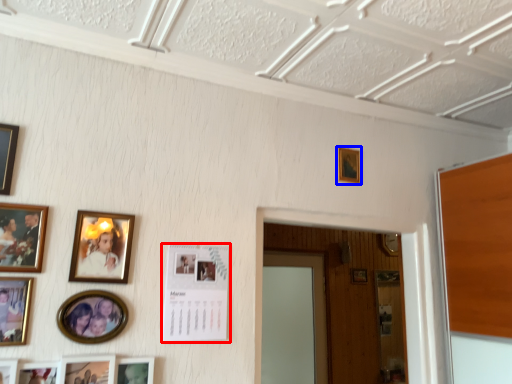
Question: Which object appears farthest to the camera in this image, picture frame (highlighted by a red box) or picture frame (highlighted by a blue box)?

Choices:
 (A) picture frame
 (B) picture frame

Answer: (B)